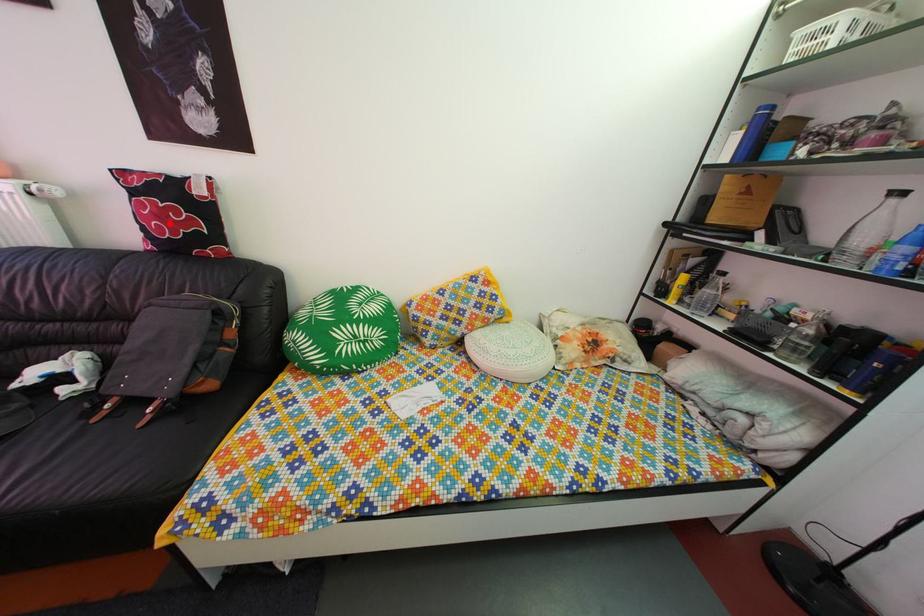
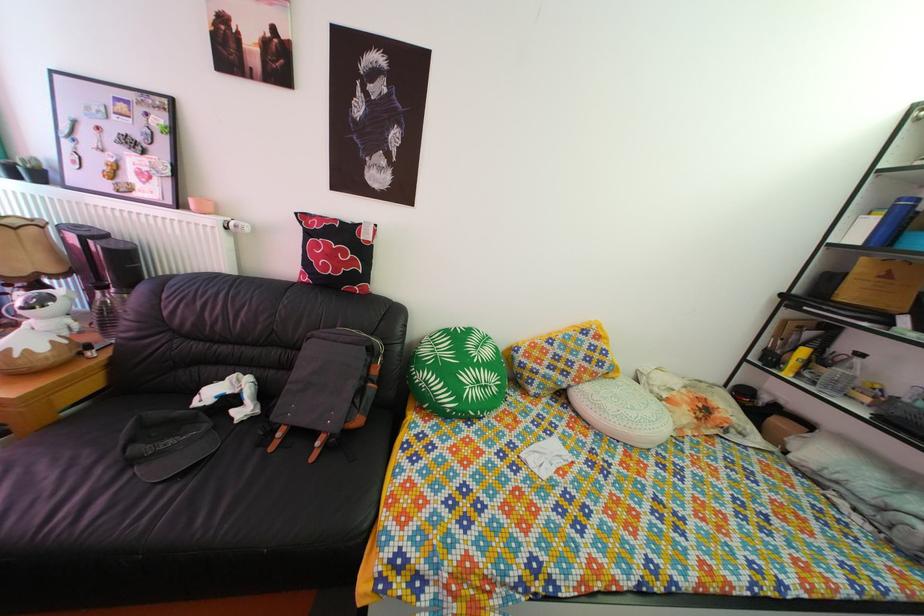
Locate, in the second image, the point that corresponds to the highlighted location in the first image.

(338, 264)